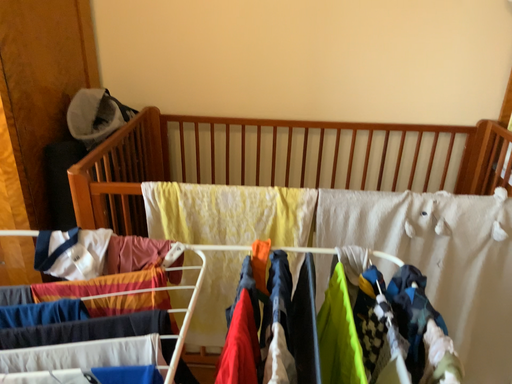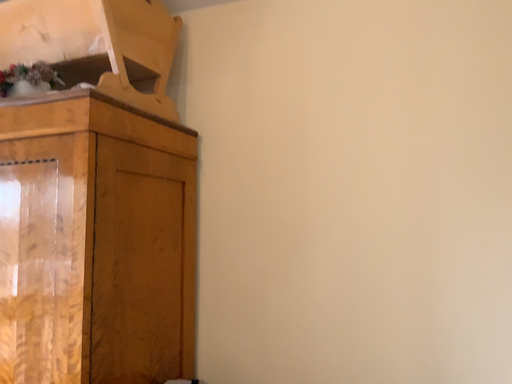
Question: How did the camera likely rotate when shooting the video?

Choices:
 (A) rotated downward
 (B) rotated upward

Answer: (B)